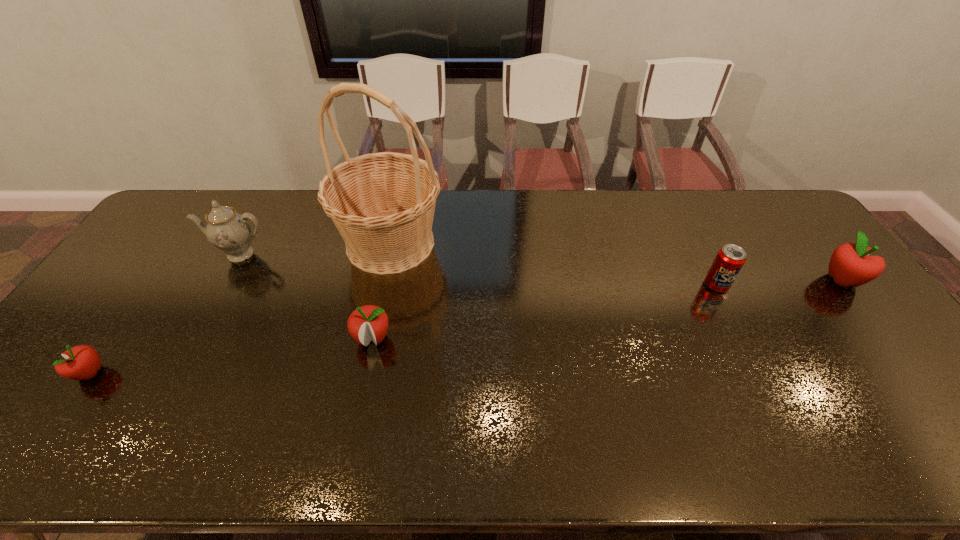
Please point a space for a new apple to maintain equal intervals. Please provide its 2D coordinates. Your answer should be formatted as a tuple, i.e. [(x, y)], where the tuple contains the x and y coordinates of a point satisfying the conditions above.

[(621, 307)]